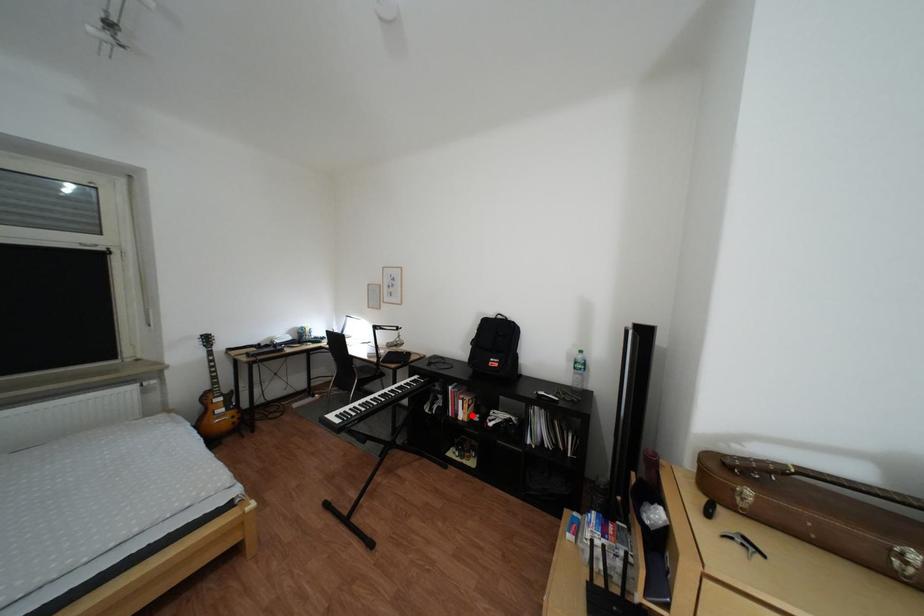
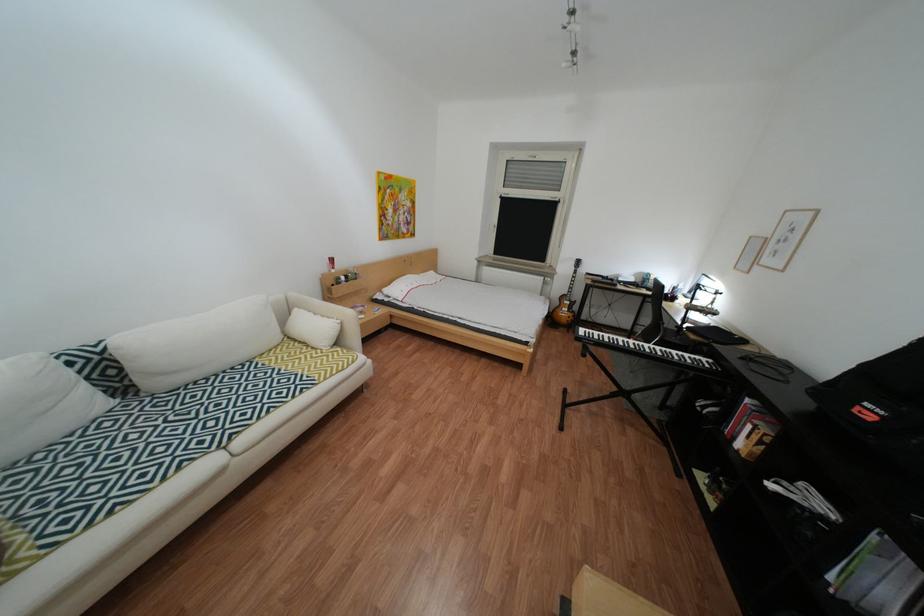
Find the pixel in the second image that matches the highlighted location in the first image.

(749, 439)